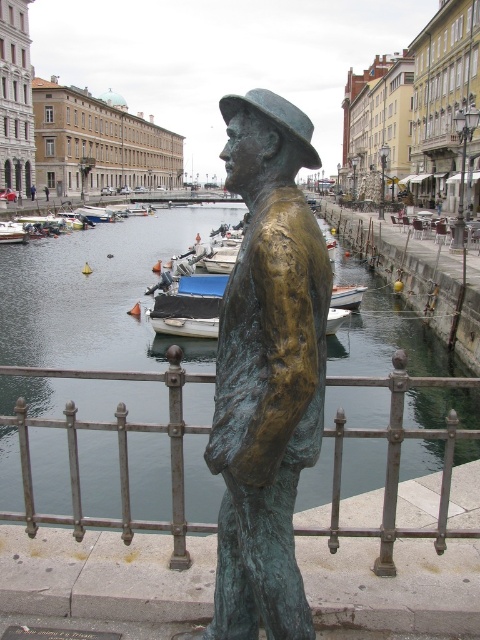
Is blue matte boat at center shorter than white wooden boat at lower left?

No.

Is the position of blue matte boat at center more distant than that of white wooden boat at lower left?

No, it is in front of white wooden boat at lower left.

Does point (158, 292) lie behind point (14, 225)?

That is False.

This screenshot has width=480, height=640. Find the location of `blue matte boat at center`. blue matte boat at center is located at coordinates (190, 307).

Which of these two, greenish-blue water at center or white wooden boat at lower left, stands shorter?

white wooden boat at lower left is shorter.

Between greenish-blue water at center and white wooden boat at lower left, which one has more height?

greenish-blue water at center is taller.

What do you see at coordinates (103, 396) in the screenshot?
I see `greenish-blue water at center` at bounding box center [103, 396].

The height and width of the screenshot is (640, 480). I want to click on greenish-blue water at center, so click(x=103, y=396).

Does bronze statue at center appear under white wooden boat at lower left?

Yes, bronze statue at center is below white wooden boat at lower left.

Looking at this image, can you confirm if bronze statue at center is positioned above white wooden boat at lower left?

No, bronze statue at center is not above white wooden boat at lower left.

Which is behind, point (313, 340) or point (23, 241)?

The point (23, 241) is behind.

You are a GUI agent. You are given a task and a screenshot of the screen. Output one action in this format:
    pyautogui.click(x=<x>, y=<y>)
    Task: Click on the bronze statue at center
    This screenshot has height=640, width=480.
    Given the screenshot: What is the action you would take?
    pyautogui.click(x=266, y=371)